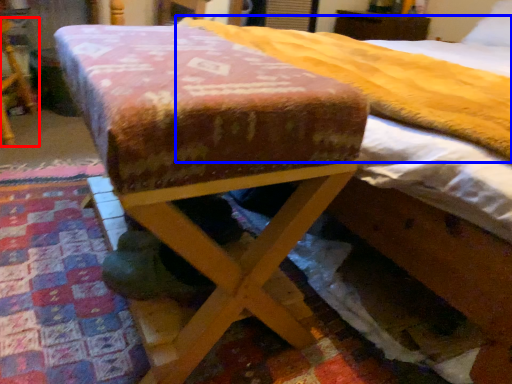
Question: Among these objects, which one is nearest to the camera, furniture (highlighted by a red box) or mattress (highlighted by a blue box)?

Choices:
 (A) furniture
 (B) mattress

Answer: (B)